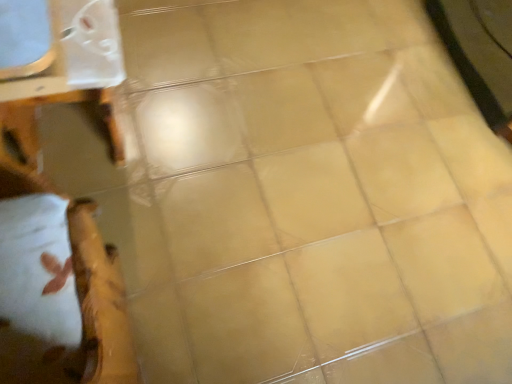
Describe the element at coordinates (57, 64) in the screenshot. I see `wooden table at left` at that location.

You are a GUI agent. You are given a task and a screenshot of the screen. Output one action in this format:
    pyautogui.click(x=<x>, y=<y>)
    Task: Click on the wooden table at left
    The height and width of the screenshot is (384, 512).
    Given the screenshot: What is the action you would take?
    pyautogui.click(x=57, y=64)

Consider the image. What is the approximate width of wooden table at left?

Result: The width of wooden table at left is 14.07 inches.

This screenshot has width=512, height=384. What are the coordinates of `wooden table at left` in the screenshot? It's located at (57, 64).